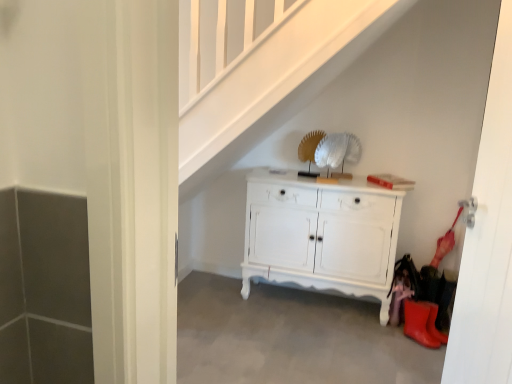
Question: Does gray concrete at lower center turn towards white painted wood cabinet at center?

Choices:
 (A) yes
 (B) no

Answer: (B)

Question: Can you confirm if gray concrete at lower center is taller than white painted wood cabinet at center?

Choices:
 (A) no
 (B) yes

Answer: (A)

Question: Is gray concrete at lower center shorter than white painted wood cabinet at center?

Choices:
 (A) yes
 (B) no

Answer: (A)

Question: From the image's perspective, does gray concrete at lower center appear lower than white painted wood cabinet at center?

Choices:
 (A) yes
 (B) no

Answer: (A)

Question: Is gray concrete at lower center outside white painted wood cabinet at center?

Choices:
 (A) no
 (B) yes

Answer: (B)

Question: From the image's perspective, relative to gray concrete at lower center, is white painted wood cabinet at center above or below?

Choices:
 (A) above
 (B) below

Answer: (A)

Question: Considering their positions, is white painted wood cabinet at center located in front of or behind gray concrete at lower center?

Choices:
 (A) behind
 (B) front

Answer: (A)

Question: In terms of size, does white painted wood cabinet at center appear bigger or smaller than gray concrete at lower center?

Choices:
 (A) small
 (B) big

Answer: (B)

Question: From a real-world perspective, relative to gray concrete at lower center, is white painted wood cabinet at center vertically above or below?

Choices:
 (A) below
 (B) above

Answer: (B)

Question: Does point (x=183, y=337) appear closer or farther from the camera than point (x=424, y=344)?

Choices:
 (A) closer
 (B) farther

Answer: (A)

Question: Is gray concrete at lower center inside the boundaries of rubber/matte boot at lower right, or outside?

Choices:
 (A) inside
 (B) outside

Answer: (B)

Question: Looking at the image, does gray concrete at lower center seem bigger or smaller compared to rubber/matte boot at lower right?

Choices:
 (A) small
 (B) big

Answer: (B)

Question: From a real-world perspective, is gray concrete at lower center physically located above or below rubber/matte boot at lower right?

Choices:
 (A) below
 (B) above

Answer: (A)

Question: Which is correct: white glossy door at right is inside white painted wood cabinet at center, or outside of it?

Choices:
 (A) inside
 (B) outside

Answer: (B)

Question: In terms of height, does white glossy door at right look taller or shorter compared to white painted wood cabinet at center?

Choices:
 (A) short
 (B) tall

Answer: (B)